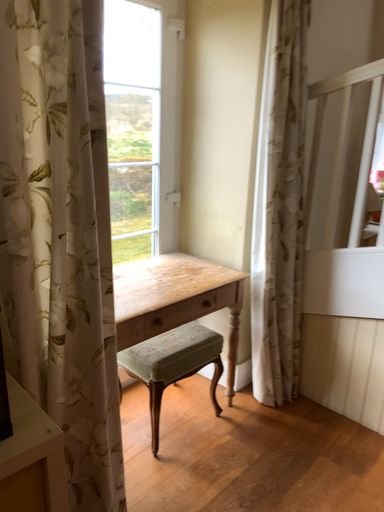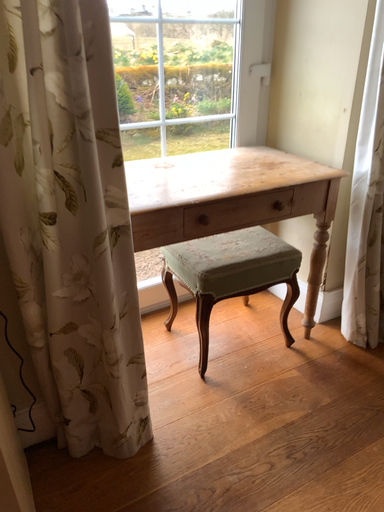
Question: Which way did the camera rotate in the video?

Choices:
 (A) rotated left
 (B) rotated right

Answer: (A)